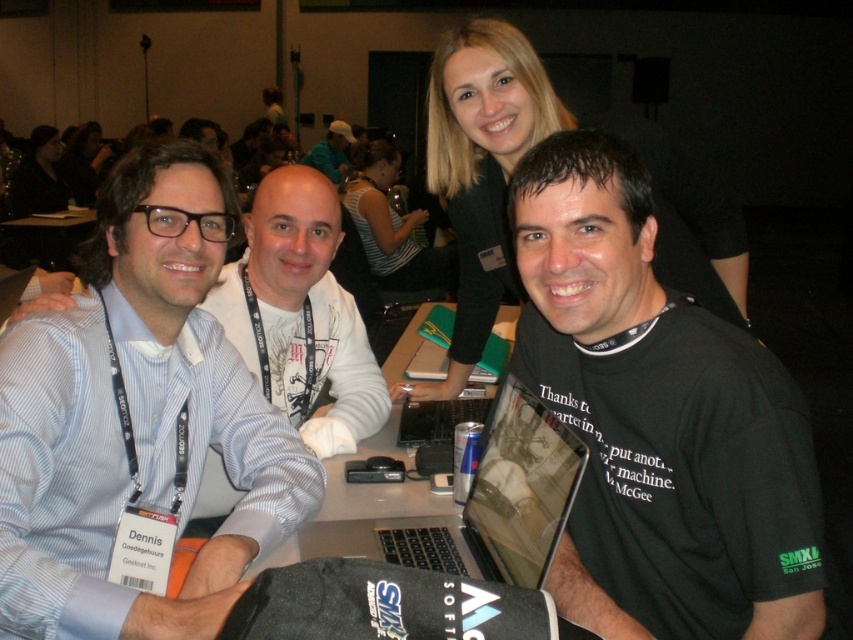
Question: Is blue striped shirt at center bigger than silver metallic laptop at center?

Choices:
 (A) yes
 (B) no

Answer: (A)

Question: Is the position of silver metallic laptop at center less distant than that of green fabric cap at upper center?

Choices:
 (A) yes
 (B) no

Answer: (A)

Question: Can you confirm if blue striped shirt at center is positioned below striped fabric shirt at center?

Choices:
 (A) yes
 (B) no

Answer: (A)

Question: Which object appears farthest from the camera in this image?

Choices:
 (A) striped fabric shirt at center
 (B) blonde hair at upper center

Answer: (A)

Question: Which point is closer to the camera taking this photo?

Choices:
 (A) (231, 545)
 (B) (482, 308)

Answer: (A)

Question: Which is farther from the green fabric cap at upper center?

Choices:
 (A) black matte t-shirt at center
 (B) blonde hair at upper center
 (C) striped fabric shirt at center

Answer: (A)